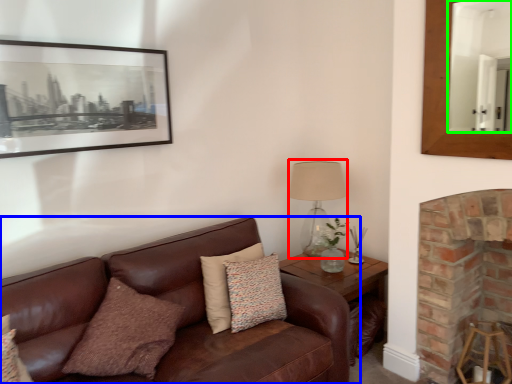
Question: Which object is the closest to the table lamp (highlighted by a red box)? Choose among these: studio couch (highlighted by a blue box) or mirror (highlighted by a green box).

Choices:
 (A) studio couch
 (B) mirror

Answer: (A)